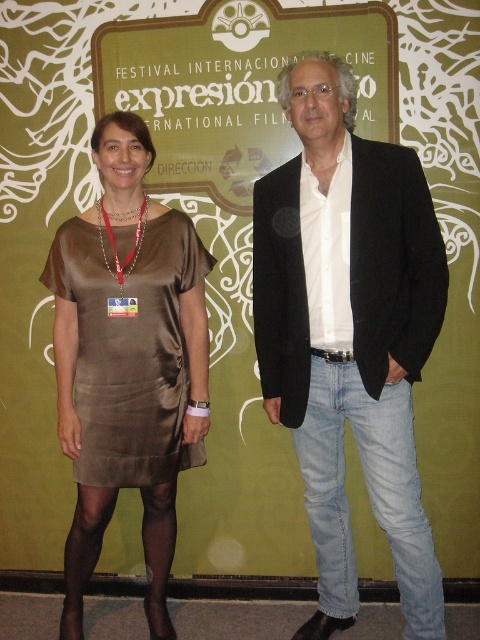
You are at the Festival Internacional Cine Expresion and need to find the person wearing the satin dress at left. According to the coordinates provided, where should you look to find this person?

The satin dress at left is located at point 0.547 on the x axis and 0.271 on the y axis.